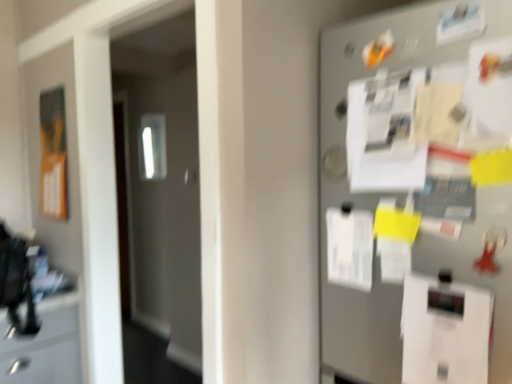
Locate an element on the screen. This screenshot has width=512, height=384. white paper at center, arranged as the second paper when viewed from the right is located at coordinates (350, 248).

Describe the element at coordinates (350, 248) in the screenshot. I see `white paper at center, the 1th paper from the left` at that location.

Measure the distance between point (428, 317) and camera.

3.62 feet.

What is the approximate height of transparent glass door at left?

The height of transparent glass door at left is 1.66 meters.

Find the location of a particular element. This screenshot has width=512, height=384. white paper at center, placed as the 1th paper when sorted from top to bottom is located at coordinates (350, 248).

Is there a large distance between metallic gray fridge at right and orange matte poster at left?

Yes, metallic gray fridge at right is far from orange matte poster at left.

Considering the sizes of objects metallic gray fridge at right and orange matte poster at left in the image provided, who is wider, metallic gray fridge at right or orange matte poster at left?

With larger width is metallic gray fridge at right.

Is point (441, 334) behind point (51, 186)?

No.

Is transparent glass door at left directly adjacent to metallic gray fridge at right?

They are not placed beside each other.

Considering the positions of point (110, 46) and point (506, 277), is point (110, 46) closer or farther from the camera than point (506, 277)?

Point (110, 46) is farther from the camera than point (506, 277).

Can metallic gray fridge at right be found inside transparent glass door at left?

No, metallic gray fridge at right is located outside of transparent glass door at left.

Is transparent glass door at left closer to the viewer compared to metallic gray fridge at right?

No, it is behind metallic gray fridge at right.

In the scene shown: From a real-world perspective, is white paper at center, marked as the second paper in a left-to-right arrangement, positioned above or below transparent glass door at left?

From a real-world perspective, white paper at center, marked as the second paper in a left-to-right arrangement, is physically below transparent glass door at left.

Is white paper at center, the second paper in the top-to-bottom sequence, in contact with transparent glass door at left?

No, white paper at center, the second paper in the top-to-bottom sequence, is not in contact with transparent glass door at left.

From the image's perspective, which object appears higher, white paper at center, placed as the 1th paper when sorted from bottom to top, or transparent glass door at left?

From the image's view, transparent glass door at left is above.

Is metallic gray fridge at right positioned far away from white paper at center, which ranks as the 1th paper in right-to-left order?

They are positioned close to each other.

From the image's perspective, between metallic gray fridge at right and white paper at center, marked as the first paper in a front-to-back arrangement, who is located below?

white paper at center, marked as the first paper in a front-to-back arrangement, from the image's perspective.

Does point (440, 279) lie behind point (449, 320)?

That is True.

In the scene shown: Is the depth of metallic gray fridge at right greater than that of white paper at center, marked as the second paper in a left-to-right arrangement?

No, the depth of metallic gray fridge at right is less than that of white paper at center, marked as the second paper in a left-to-right arrangement.

Does transparent glass door at left have a smaller size compared to orange matte poster at left?

Actually, transparent glass door at left might be larger than orange matte poster at left.

From a real-world perspective, is transparent glass door at left beneath orange matte poster at left?

Yes, from a real-world perspective, transparent glass door at left is below orange matte poster at left.

Does transparent glass door at left come in front of orange matte poster at left?

Yes.

Which of these two, transparent glass door at left or orange matte poster at left, stands taller?

Standing taller between the two is transparent glass door at left.

Considering the relative sizes of transparent glass door at left and white paper at center, the second paper in the top-to-bottom sequence, in the image provided, is transparent glass door at left wider than white paper at center, the second paper in the top-to-bottom sequence,?

Correct, the width of transparent glass door at left exceeds that of white paper at center, the second paper in the top-to-bottom sequence.

Is transparent glass door at left oriented away from white paper at center, which ranks as the 1th paper in right-to-left order?

That's not correct — transparent glass door at left is not looking away from white paper at center, which ranks as the 1th paper in right-to-left order.

Starting from the transparent glass door at left, which paper is the 2nd one to the right? Please provide its 2D coordinates.

[(445, 331)]

Which of these two, transparent glass door at left or white paper at center, placed as the 1th paper when sorted from bottom to top, is bigger?

transparent glass door at left.

Considering the sizes of objects white paper at center, which ranks as the second paper in bottom-to-top order, and metallic gray fridge at right in the image provided, who is shorter, white paper at center, which ranks as the second paper in bottom-to-top order, or metallic gray fridge at right?

Standing shorter between the two is white paper at center, which ranks as the second paper in bottom-to-top order.

Is point (353, 217) behind point (416, 205)?

Yes, point (353, 217) is farther from viewer.

Is white paper at center, placed as the 1th paper when sorted from top to bottom, smaller than metallic gray fridge at right?

Yes.

What's the angular difference between white paper at center, placed as the 1th paper when sorted from top to bottom, and metallic gray fridge at right's facing directions?

The angle between the facing direction of white paper at center, placed as the 1th paper when sorted from top to bottom, and the facing direction of metallic gray fridge at right is 2.72 degrees.

I want to click on fridge on the right of orange matte poster at left, so click(x=417, y=197).

Where is `fridge above the transparent glass door at left (from a real-world perspective)`? Image resolution: width=512 pixels, height=384 pixels. fridge above the transparent glass door at left (from a real-world perspective) is located at coordinates (417, 197).

Which object lies nearer to the anchor point orange matte poster at left, metallic gray fridge at right or white paper at center, placed as the second paper when sorted from back to front?

Based on the image, metallic gray fridge at right appears to be nearer to orange matte poster at left.

Based on their spatial positions, is white paper at center, the 1th paper positioned from the back, or white paper at center, marked as the first paper in a front-to-back arrangement, closer to metallic gray fridge at right?

Among the two, white paper at center, marked as the first paper in a front-to-back arrangement, is located nearer to metallic gray fridge at right.

Considering their positions, is transparent glass door at left positioned further to white paper at center, marked as the second paper in a left-to-right arrangement, than metallic gray fridge at right?

transparent glass door at left lies further to white paper at center, marked as the second paper in a left-to-right arrangement, than the other object.

Looking at the image, which one is located further to metallic gray fridge at right, orange matte poster at left or transparent glass door at left?

The object further to metallic gray fridge at right is transparent glass door at left.

Looking at the image, which one is located closer to white paper at center, placed as the second paper when sorted from back to front, orange matte poster at left or transparent glass door at left?

orange matte poster at left is closer to white paper at center, placed as the second paper when sorted from back to front.

Estimate the real-world distances between objects in this image. Which object is further from white paper at center, which ranks as the second paper in bottom-to-top order, transparent glass door at left or white paper at center, marked as the second paper in a left-to-right arrangement?

The object further to white paper at center, which ranks as the second paper in bottom-to-top order, is transparent glass door at left.

Estimate the real-world distances between objects in this image. Which object is closer to metallic gray fridge at right, orange matte poster at left or white paper at center, placed as the second paper when sorted from back to front?

The object closer to metallic gray fridge at right is white paper at center, placed as the second paper when sorted from back to front.

From the image, which object appears to be farther from transparent glass door at left, white paper at center, marked as the second paper in a left-to-right arrangement, or metallic gray fridge at right?

Among the two, white paper at center, marked as the second paper in a left-to-right arrangement, is located further to transparent glass door at left.

This screenshot has height=384, width=512. In order to click on fridge located between orange matte poster at left and white paper at center, marked as the second paper in a left-to-right arrangement, in the left-right direction in this screenshot , I will do `click(417, 197)`.

Image resolution: width=512 pixels, height=384 pixels. Identify the location of paper located between orange matte poster at left and white paper at center, marked as the first paper in a front-to-back arrangement, in the left-right direction. (350, 248).

Find the location of a particular element. The height and width of the screenshot is (384, 512). paper situated between transparent glass door at left and metallic gray fridge at right from left to right is located at coordinates (350, 248).

You are a GUI agent. You are given a task and a screenshot of the screen. Output one action in this format:
    pyautogui.click(x=<x>, y=<y>)
    Task: Click on the glass door between orange matte poster at left and white paper at center, the 1th paper positioned from the back, in the horizontal direction
    The image size is (512, 384).
    Given the screenshot: What is the action you would take?
    pyautogui.click(x=160, y=183)